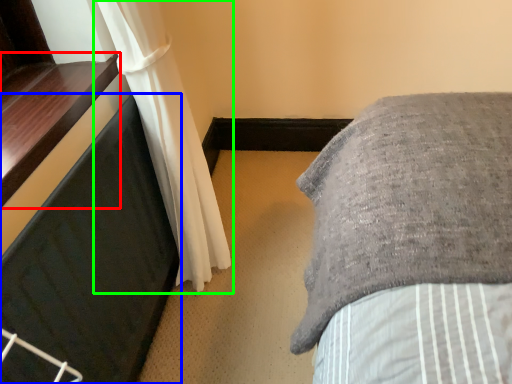
Question: Which is farther away from window sill (highlighted by a red box)? furniture (highlighted by a blue box) or curtain (highlighted by a green box)?

Choices:
 (A) furniture
 (B) curtain

Answer: (B)